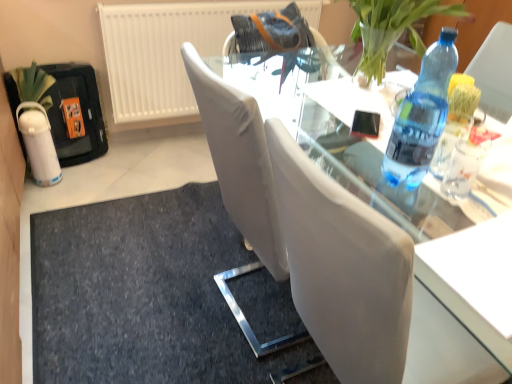
Question: In the image, is dark gray fabric doormat at lower center positioned in front of or behind transparent glass table at center?

Choices:
 (A) behind
 (B) front

Answer: (A)

Question: Considering the positions of point (176, 201) and point (406, 215), is point (176, 201) closer or farther from the camera than point (406, 215)?

Choices:
 (A) farther
 (B) closer

Answer: (A)

Question: Which is nearer to the blue plastic bottle at right?

Choices:
 (A) dark gray fabric doormat at lower center
 (B) transparent glass table at center
 (C) white textured radiator at upper left

Answer: (B)

Question: Which of these objects is positioned closest to the blue plastic bottle at right?

Choices:
 (A) white textured radiator at upper left
 (B) transparent glass table at center
 (C) dark gray fabric doormat at lower center

Answer: (B)